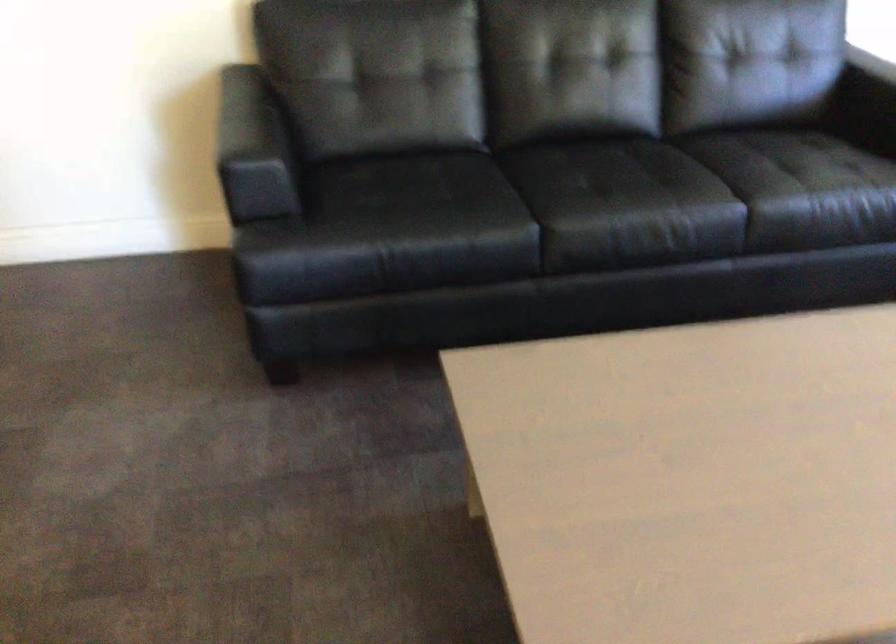
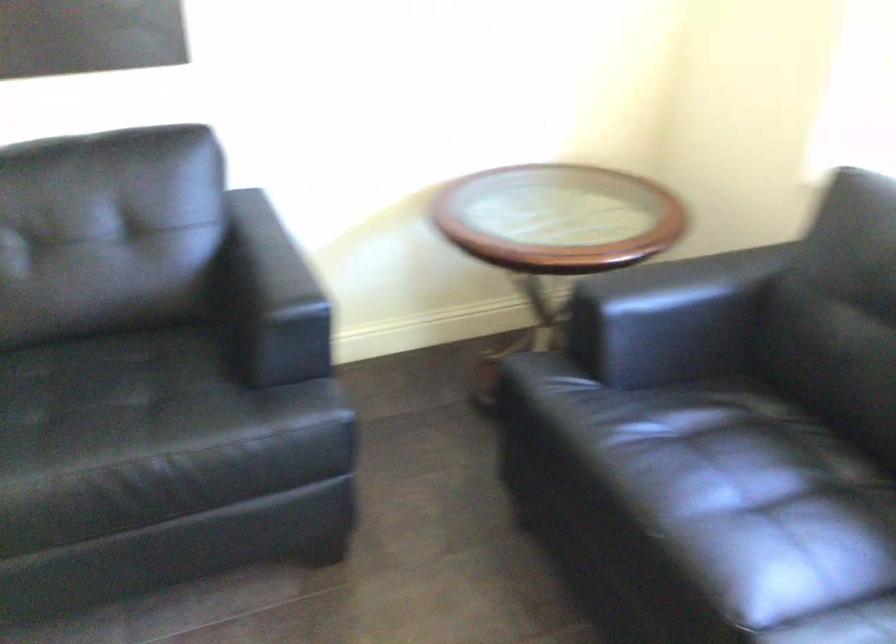
Which direction would the cameraman need to move to produce the second image?

The cameraman walked toward right, forward.